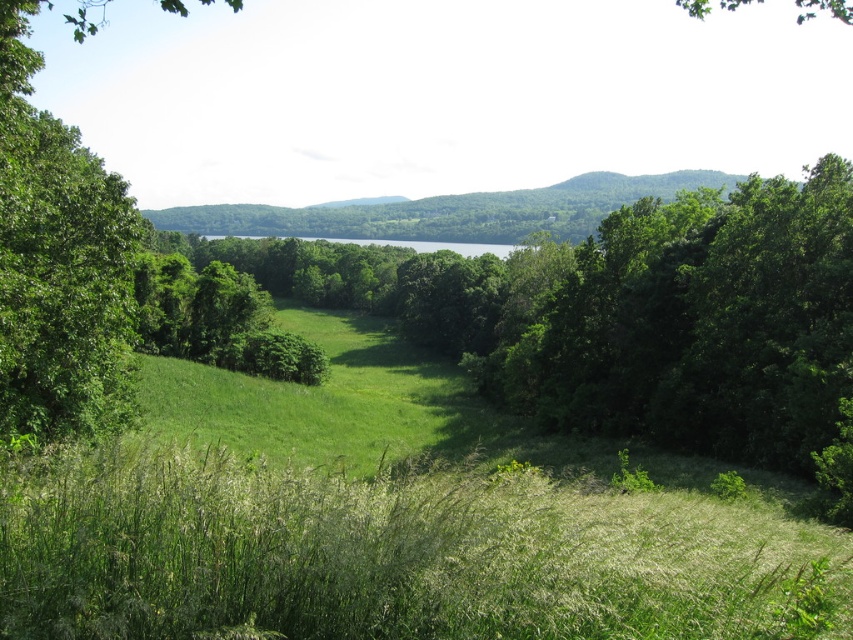
Question: Which object appears closest to the camera in this image?

Choices:
 (A) green grassy field at center
 (B) green grassy hillside at center

Answer: (B)

Question: Which object appears farthest from the camera in this image?

Choices:
 (A) green grassy hillside at center
 (B) green grassy field at center

Answer: (B)

Question: Is green grassy hillside at center smaller than green grassy field at center?

Choices:
 (A) yes
 (B) no

Answer: (B)

Question: Can you confirm if green grassy hillside at center is thinner than green grassy field at center?

Choices:
 (A) yes
 (B) no

Answer: (B)

Question: Can you confirm if green grassy hillside at center is positioned to the right of green grassy field at center?

Choices:
 (A) yes
 (B) no

Answer: (A)